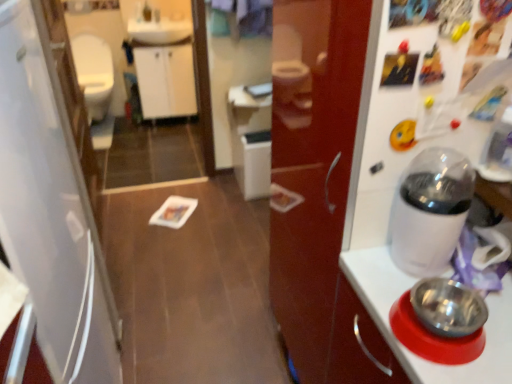
Question: From the image's perspective, is metallic stainless steel bowl at right on white glossy toilet bowl at left?

Choices:
 (A) no
 (B) yes

Answer: (A)

Question: Does metallic stainless steel bowl at right turn towards white glossy toilet bowl at left?

Choices:
 (A) no
 (B) yes

Answer: (A)

Question: Considering the relative sizes of metallic stainless steel bowl at right and white glossy toilet bowl at left in the image provided, is metallic stainless steel bowl at right bigger than white glossy toilet bowl at left?

Choices:
 (A) yes
 (B) no

Answer: (B)

Question: Can you confirm if metallic stainless steel bowl at right is positioned to the left of white glossy toilet bowl at left?

Choices:
 (A) no
 (B) yes

Answer: (A)

Question: Is metallic stainless steel bowl at right not within white glossy toilet bowl at left?

Choices:
 (A) no
 (B) yes

Answer: (B)

Question: Considering the relative positions of metallic stainless steel bowl at right and white glossy toilet bowl at left in the image provided, is metallic stainless steel bowl at right in front of white glossy toilet bowl at left?

Choices:
 (A) yes
 (B) no

Answer: (A)

Question: Can you confirm if white glossy coffee maker at right is thinner than white matte refrigerator at left?

Choices:
 (A) no
 (B) yes

Answer: (B)

Question: Would you consider white glossy coffee maker at right to be distant from white matte refrigerator at left?

Choices:
 (A) no
 (B) yes

Answer: (A)

Question: Is the depth of white glossy coffee maker at right greater than that of white matte refrigerator at left?

Choices:
 (A) yes
 (B) no

Answer: (A)

Question: Does white glossy coffee maker at right have a smaller size compared to white matte refrigerator at left?

Choices:
 (A) yes
 (B) no

Answer: (A)

Question: Is white glossy coffee maker at right directly adjacent to white matte refrigerator at left?

Choices:
 (A) no
 (B) yes

Answer: (A)

Question: Is white glossy coffee maker at right taller than white matte refrigerator at left?

Choices:
 (A) no
 (B) yes

Answer: (A)

Question: From the image's perspective, is white glossy sink at upper center beneath white matte refrigerator at left?

Choices:
 (A) no
 (B) yes

Answer: (A)